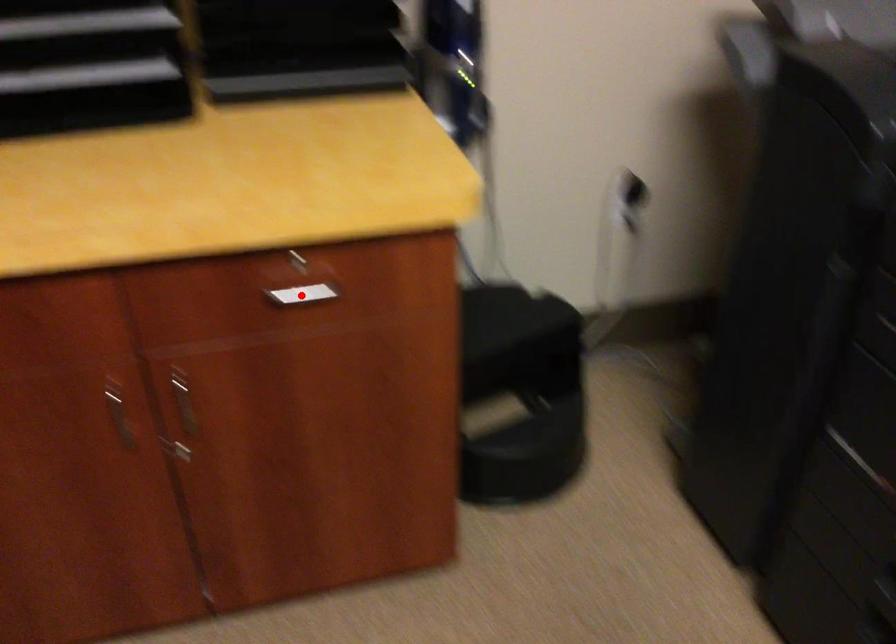
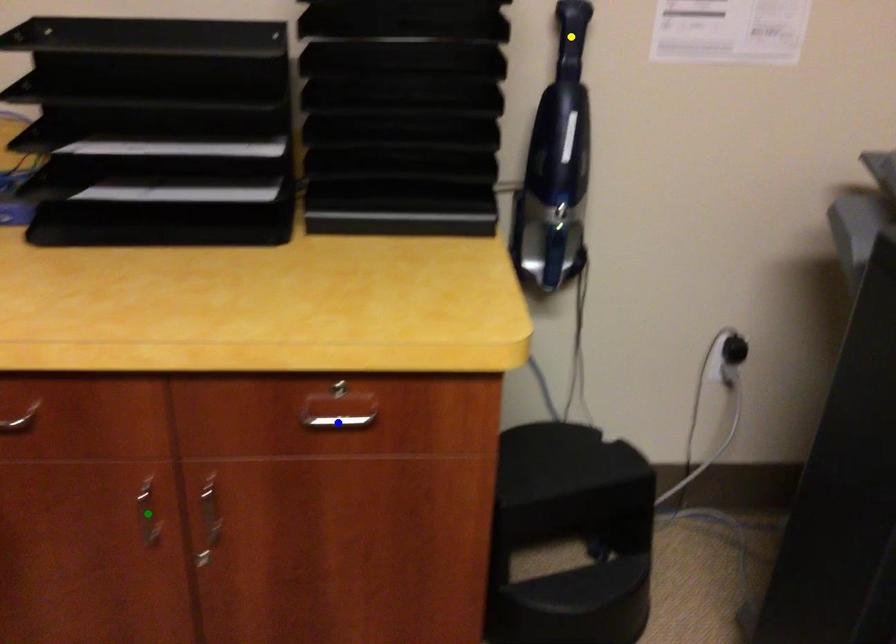
Question: I am providing you with two images of the same scene from different viewpoints. A red point is marked on the first image. You are given multiple points on the second image. Can you choose the point in image 2 that corresponds to the point in image 1?

Choices:
 (A) blue point
 (B) green point
 (C) yellow point

Answer: (A)